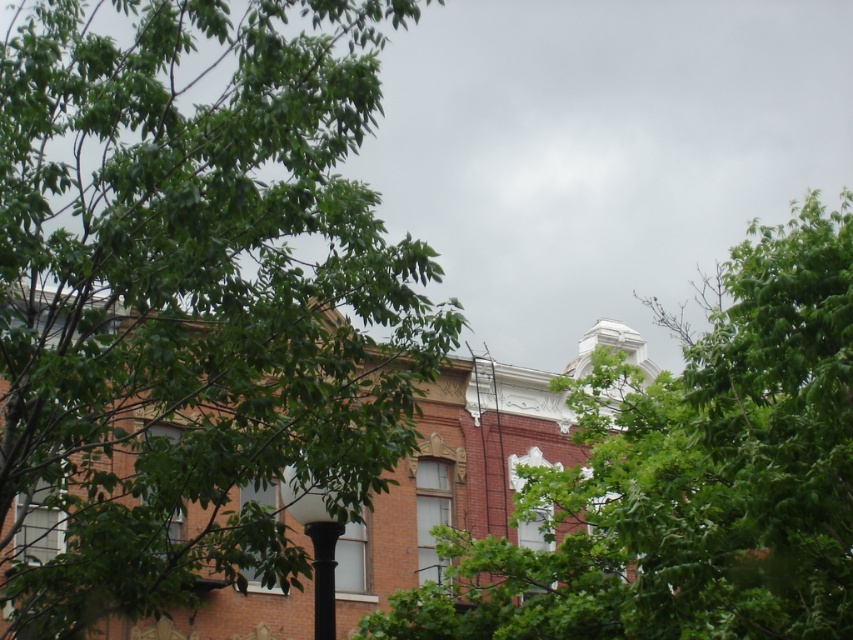
Question: Does green leafy tree at upper left appear over green leafy tree at upper center?

Choices:
 (A) no
 (B) yes

Answer: (B)

Question: Is green leafy tree at upper left smaller than green leafy tree at upper center?

Choices:
 (A) no
 (B) yes

Answer: (A)

Question: Which point is closer to the camera?

Choices:
 (A) (585, 380)
 (B) (375, 301)

Answer: (B)

Question: Is green leafy tree at upper left further to camera compared to green leafy tree at upper center?

Choices:
 (A) no
 (B) yes

Answer: (A)